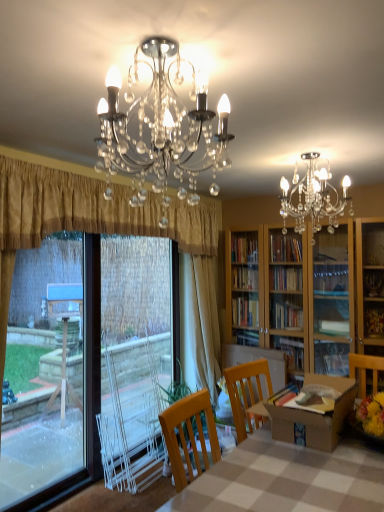
Question: Is point (69, 442) positioned closer to the camera than point (180, 342)?

Choices:
 (A) closer
 (B) farther

Answer: (A)

Question: Visually, is transparent plastic window screen at left positioned to the left or to the right of beige fabric curtain at center, the second curtain when ordered from front to back?

Choices:
 (A) right
 (B) left

Answer: (B)

Question: Based on their relative distances, which object is nearer to the clear crystal chandelier at upper center?

Choices:
 (A) brown cardboard box at center
 (B) beige fabric curtain at center, the second curtain when ordered from front to back
 (C) white plastic screen door at left
 (D) transparent plastic window screen at left
 (E) gold textured curtain at left, acting as the 1th curtain starting from the front

Answer: (E)

Question: Considering the real-world distances, which object is farthest from the checkerboard fabric table at center?

Choices:
 (A) transparent plastic window screen at left
 (B) brown cardboard box at center
 (C) clear crystal chandelier at upper center
 (D) beige fabric curtain at center, the second curtain when ordered from front to back
 (E) white plastic screen door at left

Answer: (D)